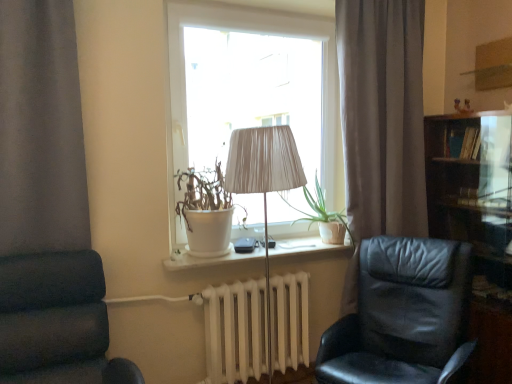
The width and height of the screenshot is (512, 384). What do you see at coordinates (209, 259) in the screenshot?
I see `white ceramic window sill at center` at bounding box center [209, 259].

Where is `white matte radiator at center`? white matte radiator at center is located at coordinates (234, 331).

Measure the distance between point [220,362] and camera.

Point [220,362] and camera are 2.31 meters apart.

This screenshot has height=384, width=512. Find the location of `white matte pot at window`. white matte pot at window is located at coordinates click(x=206, y=212).

What do you see at coordinates (206, 212) in the screenshot? This screenshot has height=384, width=512. I see `white matte pot at window` at bounding box center [206, 212].

Locate an element on the screen. Image resolution: width=512 pixels, height=384 pixels. green matte plant at center is located at coordinates (323, 217).

Describe the element at coordinates (381, 122) in the screenshot. This screenshot has width=512, height=384. I see `gray fabric curtain at center` at that location.

Find the location of a particular element. black leather chair at right, the 1th chair positioned from the right is located at coordinates (402, 315).

Locate an element on the screen. white ceramic window sill at center is located at coordinates (209, 259).

Could you tell me if dark blue fabric chair at left, which is the 2th chair in right-to-left order, is turned towards black leather chair at right, the 1th chair positioned from the right?

No, dark blue fabric chair at left, which is the 2th chair in right-to-left order, is not oriented towards black leather chair at right, the 1th chair positioned from the right.

Is dark blue fabric chair at left, which is the 2th chair in right-to-left order, far from black leather chair at right, the 1th chair positioned from the right?

Yes, dark blue fabric chair at left, which is the 2th chair in right-to-left order, and black leather chair at right, the 1th chair positioned from the right, are quite far apart.

From a real-world perspective, which is physically above, dark blue fabric chair at left, which is the 1th chair in left-to-right order, or black leather chair at right, the 1th chair positioned from the right?

dark blue fabric chair at left, which is the 1th chair in left-to-right order, is physically above.

Identify the location of chair that appears in front of the black leather chair at right, which appears as the 2th chair when viewed from the left. (57, 322).

Based on their sizes in the image, would you say dark wood bookshelf at right is bigger or smaller than white ceramic window sill at center?

Considering their sizes, dark wood bookshelf at right takes up more space than white ceramic window sill at center.

Does dark wood bookshelf at right come in front of white ceramic window sill at center?

Yes, dark wood bookshelf at right is in front of white ceramic window sill at center.

From a real-world perspective, is dark wood bookshelf at right on top of white ceramic window sill at center?

No.

Who is taller, dark wood bookshelf at right or white ceramic window sill at center?

With more height is dark wood bookshelf at right.

Are white matte radiator at center and dark blue fabric chair at left, which is the 2th chair in right-to-left order, located far from each other?

No, white matte radiator at center is not far from dark blue fabric chair at left, which is the 2th chair in right-to-left order.

From the picture: From a real-world perspective, is white matte radiator at center on top of dark blue fabric chair at left, which is the 1th chair in left-to-right order?

No.

Looking at this image, considering the positions of objects white matte radiator at center and dark blue fabric chair at left, which is the 1th chair in left-to-right order, in the image provided, who is more to the right, white matte radiator at center or dark blue fabric chair at left, which is the 1th chair in left-to-right order,?

white matte radiator at center is more to the right.

How far apart are white matte radiator at center and dark blue fabric chair at left, which is the 1th chair in left-to-right order?

white matte radiator at center is 75.65 centimeters from dark blue fabric chair at left, which is the 1th chair in left-to-right order.

From a real-world perspective, which object stands above the other?

white matte pot at window is physically above.

From the image's perspective, is white matte pot at window above or below gray fabric curtain at center?

From the image's perspective, white matte pot at window appears below gray fabric curtain at center.

Based on the photo, is gray fabric curtain at center located within white matte pot at window?

That's incorrect, gray fabric curtain at center is not inside white matte pot at window.

Considering the relative sizes of white matte pot at window and gray fabric curtain at center in the image provided, is white matte pot at window wider than gray fabric curtain at center?

Indeed, white matte pot at window has a greater width compared to gray fabric curtain at center.

Is gray fabric curtain at center facing towards black leather chair at right, the 1th chair positioned from the right?

Yes, gray fabric curtain at center is oriented towards black leather chair at right, the 1th chair positioned from the right.

Is gray fabric curtain at center located outside black leather chair at right, which appears as the 2th chair when viewed from the left?

Yes.

How many degrees apart are the facing directions of gray fabric curtain at center and black leather chair at right, which appears as the 2th chair when viewed from the left?

They differ by 64.1 degrees in their facing directions.

Where is `curtain above the black leather chair at right, which appears as the 2th chair when viewed from the left (from the image's perspective)`? curtain above the black leather chair at right, which appears as the 2th chair when viewed from the left (from the image's perspective) is located at coordinates (381, 122).

Can you confirm if white matte radiator at center is wider than dark wood bookshelf at right?

In fact, white matte radiator at center might be narrower than dark wood bookshelf at right.

From the picture: Considering the sizes of white matte radiator at center and dark wood bookshelf at right in the image, is white matte radiator at center taller or shorter than dark wood bookshelf at right?

Clearly, white matte radiator at center is shorter compared to dark wood bookshelf at right.

Based on the photo, is white matte radiator at center positioned beyond the bounds of dark wood bookshelf at right?

Absolutely, white matte radiator at center is external to dark wood bookshelf at right.

Does white matte radiator at center lie behind dark wood bookshelf at right?

Yes, white matte radiator at center is behind dark wood bookshelf at right.

Between point (321, 216) and point (225, 208), which one is positioned in front?

The point (225, 208) is more forward.

Consider the image. Between green matte plant at center and white matte pot at window, which one has larger size?

With larger size is white matte pot at window.

Which of these two, green matte plant at center or white matte pot at window, stands taller?

With more height is white matte pot at window.

The width and height of the screenshot is (512, 384). What are the coordinates of `chair behind the dark blue fabric chair at left, which is the 2th chair in right-to-left order` in the screenshot? It's located at (402, 315).

The height and width of the screenshot is (384, 512). What are the coordinates of `window sill lying on the left of dark wood bookshelf at right` in the screenshot? It's located at (209, 259).

Which object lies further to the anchor point black leather chair at right, the 1th chair positioned from the right, dark blue fabric chair at left, which is the 1th chair in left-to-right order, or green matte plant at center?

Based on the image, dark blue fabric chair at left, which is the 1th chair in left-to-right order, appears to be further to black leather chair at right, the 1th chair positioned from the right.

Looking at the image, which one is located closer to gray fabric curtain at center, dark wood bookshelf at right or green matte plant at center?

dark wood bookshelf at right lies closer to gray fabric curtain at center than the other object.

From the image, which object appears to be nearer to white ceramic window sill at center, matte white lamp at center or black leather chair at right, which appears as the 2th chair when viewed from the left?

matte white lamp at center is closer to white ceramic window sill at center.

When comparing their distances from matte white lamp at center, does black leather chair at right, the 1th chair positioned from the right, or white ceramic window sill at center seem further?

black leather chair at right, the 1th chair positioned from the right.

From the image, which object appears to be nearer to dark blue fabric chair at left, which is the 2th chair in right-to-left order, black leather chair at right, which appears as the 2th chair when viewed from the left, or green matte plant at center?

black leather chair at right, which appears as the 2th chair when viewed from the left.

Estimate the real-world distances between objects in this image. Which object is closer to matte white lamp at center, white matte pot at window or green matte plant at center?

white matte pot at window lies closer to matte white lamp at center than the other object.

Looking at the image, which one is located further to gray fabric curtain at center, green matte plant at center or white ceramic window sill at center?

white ceramic window sill at center.

Based on the photo, looking at the image, which one is located closer to white matte radiator at center, black leather chair at right, the 1th chair positioned from the right, or matte white lamp at center?

black leather chair at right, the 1th chair positioned from the right, is positioned closer to the anchor white matte radiator at center.

You are a GUI agent. You are given a task and a screenshot of the screen. Output one action in this format:
    pyautogui.click(x=<x>, y=<y>)
    Task: Click on the window sill located between white matte radiator at center and black leather chair at right, the 1th chair positioned from the right, in the left-right direction
    The height and width of the screenshot is (384, 512).
    Given the screenshot: What is the action you would take?
    pyautogui.click(x=209, y=259)

At what (x,y) coordinates should I click in order to perform the action: click on chair between matte white lamp at center and dark wood bookshelf at right from left to right. Please return your answer as a coordinate pair (x, y). Looking at the image, I should click on (402, 315).

You are a GUI agent. You are given a task and a screenshot of the screen. Output one action in this format:
    pyautogui.click(x=<x>, y=<y>)
    Task: Click on the lamp between dark blue fabric chair at left, which is the 2th chair in right-to-left order, and white ceramic window sill at center from front to back
    The image size is (512, 384).
    Given the screenshot: What is the action you would take?
    pyautogui.click(x=264, y=180)

This screenshot has height=384, width=512. I want to click on plant situated between dark blue fabric chair at left, which is the 2th chair in right-to-left order, and gray fabric curtain at center from left to right, so click(x=323, y=217).